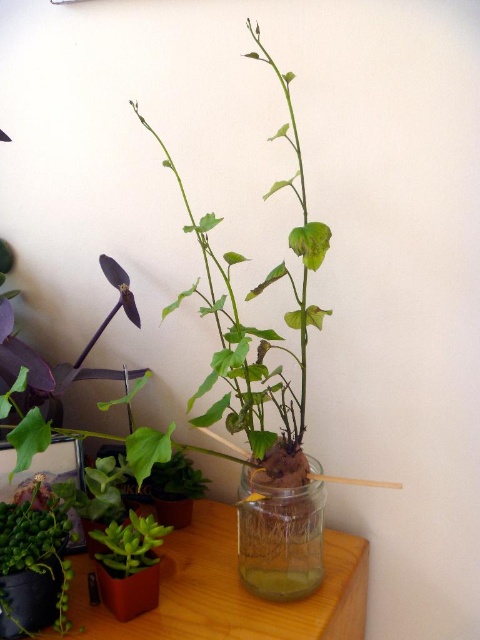
Question: Can you confirm if wooden table at center is positioned above translucent glass jar at center?

Choices:
 (A) no
 (B) yes

Answer: (A)

Question: Which is nearer to the translucent glass jar at center?

Choices:
 (A) green matte plant at center
 (B) green matte succulent at lower left
 (C) wooden table at center
 (D) green glossy succulent at lower left

Answer: (C)

Question: Is wooden table at center above translucent glass jar at center?

Choices:
 (A) no
 (B) yes

Answer: (A)

Question: Which object is positioned farthest from the green glossy succulent at lower left?

Choices:
 (A) translucent glass jar at center
 (B) green matte plant at center
 (C) green matte succulent at lower left
 (D) wooden table at center

Answer: (B)

Question: Which of these objects is positioned closest to the wooden table at center?

Choices:
 (A) translucent glass jar at center
 (B) green matte succulent at lower left
 (C) green matte plant at center

Answer: (A)

Question: Is translucent glass jar at center further to the viewer compared to green matte succulent at lower left?

Choices:
 (A) yes
 (B) no

Answer: (A)